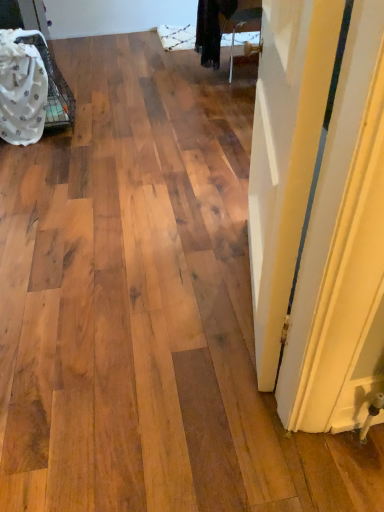
Find the location of a particular element. vacant area that lies to the right of white fabric at left is located at coordinates (104, 123).